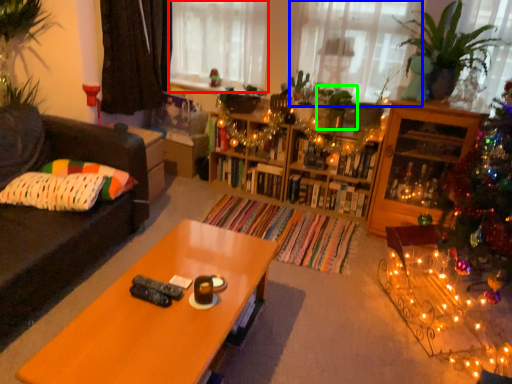
Question: Considering the real-world distances, which object is farthest from window screen (highlighted by a red box)? window (highlighted by a blue box) or plant (highlighted by a green box)?

Choices:
 (A) window
 (B) plant

Answer: (B)